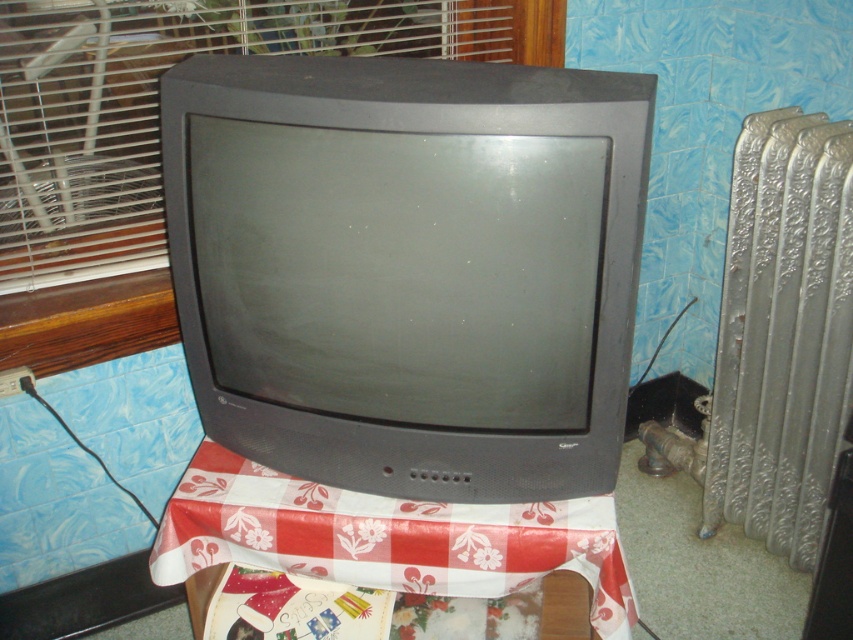
Question: Can you confirm if silver textured radiator at right is wider than plastic wrapping paper at center?

Choices:
 (A) yes
 (B) no

Answer: (B)

Question: Observing the image, what is the correct spatial positioning of silver textured radiator at right in reference to plastic wrapping paper at center?

Choices:
 (A) right
 (B) left

Answer: (A)

Question: Which object appears farthest from the camera in this image?

Choices:
 (A) silver textured radiator at right
 (B) plastic wrapping paper at center

Answer: (A)

Question: Which point appears farthest from the camera in this image?

Choices:
 (A) (779, 230)
 (B) (460, 525)

Answer: (A)

Question: Is silver textured radiator at right closer to camera compared to plastic wrapping paper at center?

Choices:
 (A) yes
 (B) no

Answer: (B)